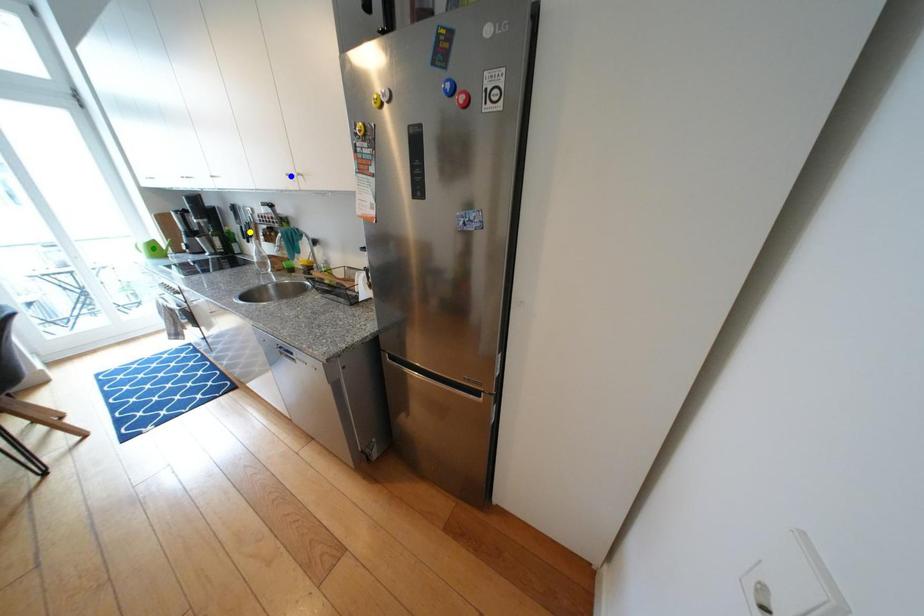
Order these from nearest to farthest:
yellow point
green point
blue point

blue point
yellow point
green point